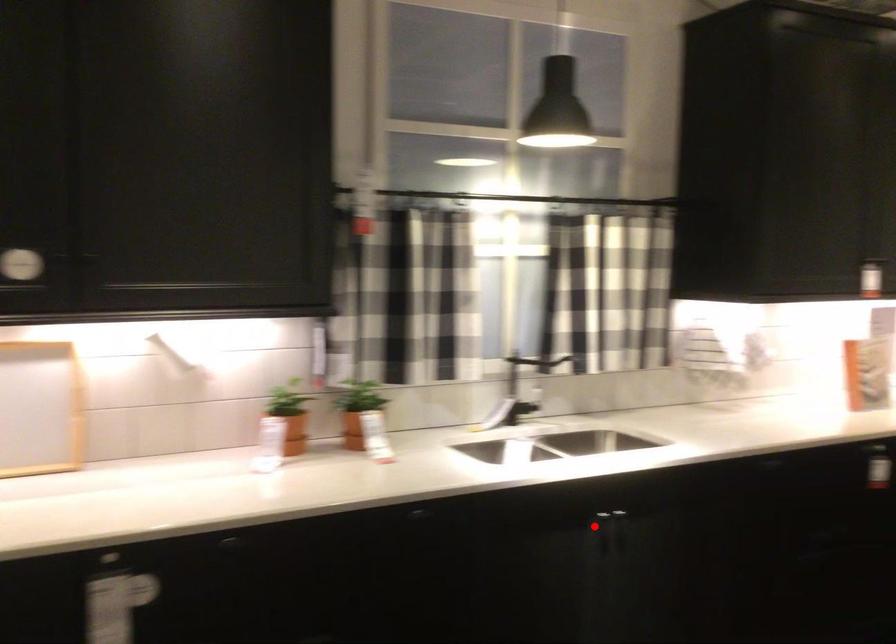
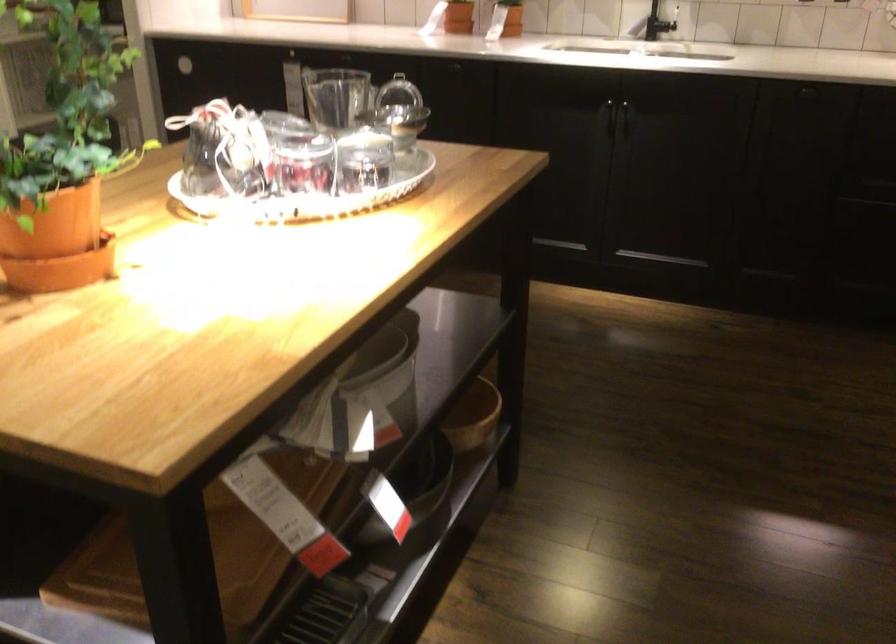
Question: I am providing you with two images of the same scene from different viewpoints. A red point is marked on the first image. Can you still see the location of the red point in image 2?

Choices:
 (A) Yes
 (B) No

Answer: (A)